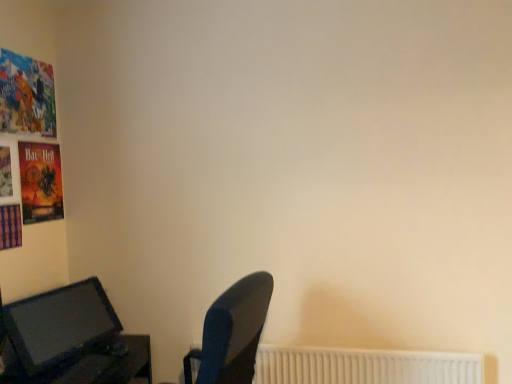
Question: Is white plastic radiator at lower right positioned with its back to matte black monitor at lower left?

Choices:
 (A) yes
 (B) no

Answer: (B)

Question: Is white plastic radiator at lower right smaller than matte black monitor at lower left?

Choices:
 (A) yes
 (B) no

Answer: (A)

Question: Considering the relative sizes of white plastic radiator at lower right and matte black monitor at lower left in the image provided, is white plastic radiator at lower right thinner than matte black monitor at lower left?

Choices:
 (A) yes
 (B) no

Answer: (A)

Question: From a real-world perspective, is white plastic radiator at lower right on top of matte black monitor at lower left?

Choices:
 (A) no
 (B) yes

Answer: (A)

Question: Is white plastic radiator at lower right closer to camera compared to matte black monitor at lower left?

Choices:
 (A) no
 (B) yes

Answer: (A)

Question: Is white plastic radiator at lower right not near matte black monitor at lower left?

Choices:
 (A) no
 (B) yes

Answer: (B)

Question: Considering the relative sizes of matte black monitor at lower left and white plastic radiator at lower right in the image provided, is matte black monitor at lower left smaller than white plastic radiator at lower right?

Choices:
 (A) yes
 (B) no

Answer: (B)

Question: Is matte black monitor at lower left far from white plastic radiator at lower right?

Choices:
 (A) yes
 (B) no

Answer: (A)

Question: From a real-world perspective, does matte black monitor at lower left stand above white plastic radiator at lower right?

Choices:
 (A) no
 (B) yes

Answer: (B)

Question: Is matte black monitor at lower left located outside white plastic radiator at lower right?

Choices:
 (A) yes
 (B) no

Answer: (A)

Question: Can you confirm if matte black monitor at lower left is taller than white plastic radiator at lower right?

Choices:
 (A) yes
 (B) no

Answer: (A)

Question: Is white plastic radiator at lower right a part of matte black monitor at lower left?

Choices:
 (A) yes
 (B) no

Answer: (B)

Question: Considering the positions of matte black monitor at lower left and white plastic radiator at lower right in the image, is matte black monitor at lower left bigger or smaller than white plastic radiator at lower right?

Choices:
 (A) big
 (B) small

Answer: (A)